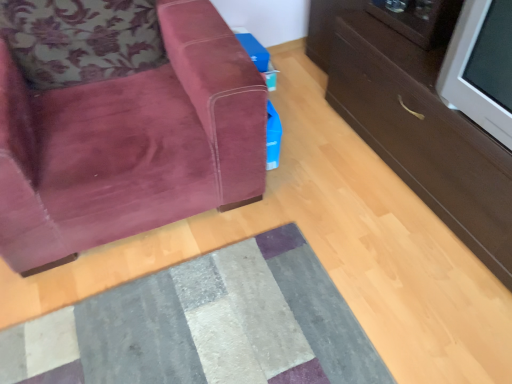
Question: Does textured gray rug at center turn towards velvet maroon armchair at left?

Choices:
 (A) yes
 (B) no

Answer: (A)

Question: Can you confirm if textured gray rug at center is shorter than velvet maroon armchair at left?

Choices:
 (A) no
 (B) yes

Answer: (B)

Question: Is textured gray rug at center looking in the opposite direction of velvet maroon armchair at left?

Choices:
 (A) no
 (B) yes

Answer: (A)

Question: Is the position of textured gray rug at center more distant than that of velvet maroon armchair at left?

Choices:
 (A) no
 (B) yes

Answer: (B)

Question: Can you confirm if textured gray rug at center is wider than velvet maroon armchair at left?

Choices:
 (A) yes
 (B) no

Answer: (B)

Question: Is textured gray rug at center outside of velvet maroon armchair at left?

Choices:
 (A) no
 (B) yes

Answer: (B)

Question: Can you confirm if velvet maroon armchair at left is taller than textured gray rug at center?

Choices:
 (A) yes
 (B) no

Answer: (A)

Question: Can we say velvet maroon armchair at left lies outside textured gray rug at center?

Choices:
 (A) yes
 (B) no

Answer: (A)

Question: Does velvet maroon armchair at left lie in front of textured gray rug at center?

Choices:
 (A) no
 (B) yes

Answer: (B)

Question: Does velvet maroon armchair at left have a lesser width compared to textured gray rug at center?

Choices:
 (A) yes
 (B) no

Answer: (B)

Question: Is velvet maroon armchair at left at the right side of textured gray rug at center?

Choices:
 (A) yes
 (B) no

Answer: (B)

Question: Is velvet maroon armchair at left smaller than textured gray rug at center?

Choices:
 (A) no
 (B) yes

Answer: (A)

Question: Considering the positions of velvet maroon armchair at left and textured gray rug at center in the image, is velvet maroon armchair at left taller or shorter than textured gray rug at center?

Choices:
 (A) short
 (B) tall

Answer: (B)